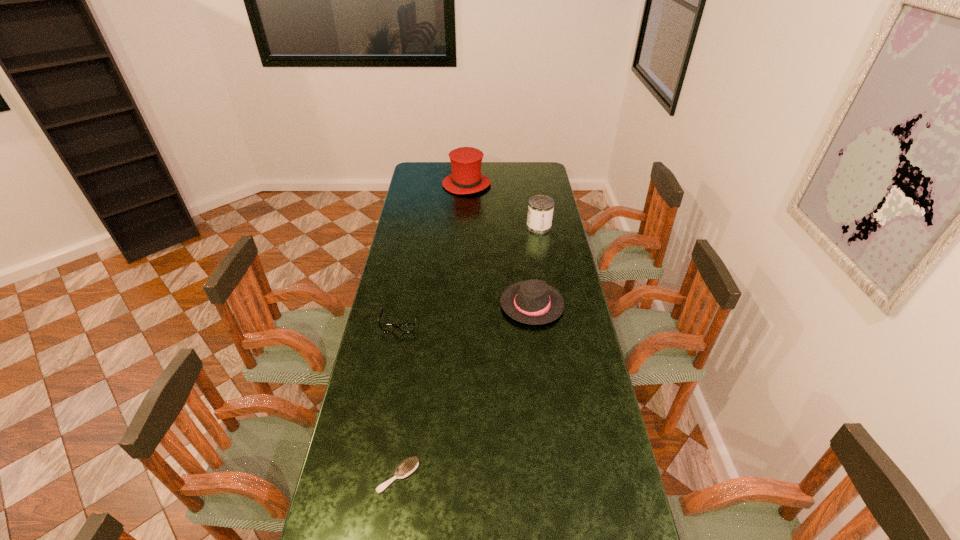
In the image, there is a desktop. At what (x,y) coordinates should I click in order to perform the action: click on vacant space at the left edge. Please return your answer as a coordinate pair (x, y). The height and width of the screenshot is (540, 960). Looking at the image, I should click on (429, 224).

I want to click on vacant space at the right edge of the desktop, so (x=573, y=401).

Where is `vacant space at the far left corner`? vacant space at the far left corner is located at coordinates (419, 178).

Locate an element on the screen. The width and height of the screenshot is (960, 540). vacant space at the far right corner of the desktop is located at coordinates (548, 168).

This screenshot has height=540, width=960. Identify the location of vacant area that lies between the can and the nearest object. (468, 352).

Where is `free space between the right dress hat and the scrubbing brush`? free space between the right dress hat and the scrubbing brush is located at coordinates (466, 390).

At what (x,y) coordinates should I click in order to perform the action: click on free space between the left dress hat and the scrubbing brush. Please return your answer as a coordinate pair (x, y). Looking at the image, I should click on (432, 330).

Locate an element on the screen. The image size is (960, 540). empty location between the scrubbing brush and the can is located at coordinates (468, 352).

Find the location of a particular element. Image resolution: width=960 pixels, height=540 pixels. vacant area between the sunglasses and the farther dress hat is located at coordinates (433, 253).

Locate an element on the screen. This screenshot has width=960, height=540. unoccupied area between the nearest object and the second shortest object is located at coordinates (399, 399).